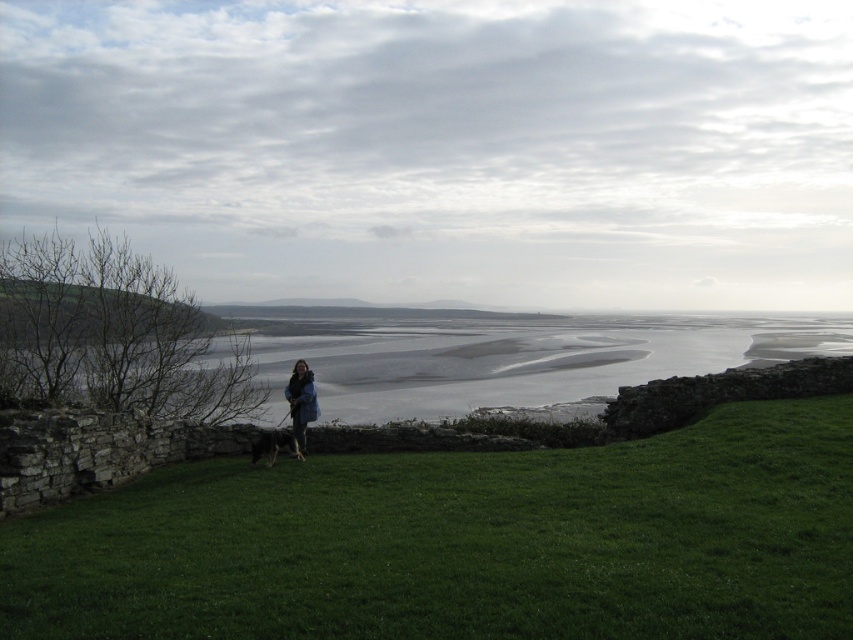
You are standing on the beach and see the gray sand at lower center and the dark blue jacket at center. Which object is higher up in the image?

The gray sand at lower center is above the dark blue jacket at center, so the gray sand at lower center is higher up in the image.

You are standing at point (260, 435) and want to walk to point (727, 358). Which direction should you move relative to the current position?

You should move backward because point (727, 358) is behind point (260, 435).